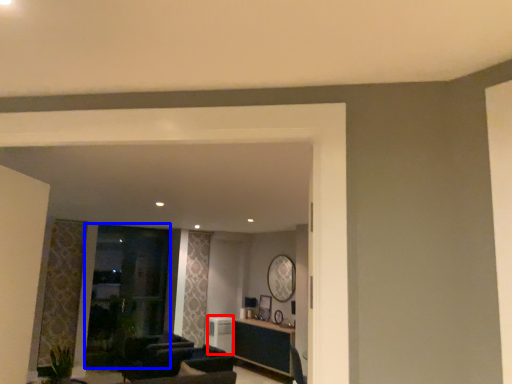
Question: Which point is closer to the camera, appliance (highlighted by a red box) or glass door (highlighted by a blue box)?

Choices:
 (A) appliance
 (B) glass door

Answer: (B)